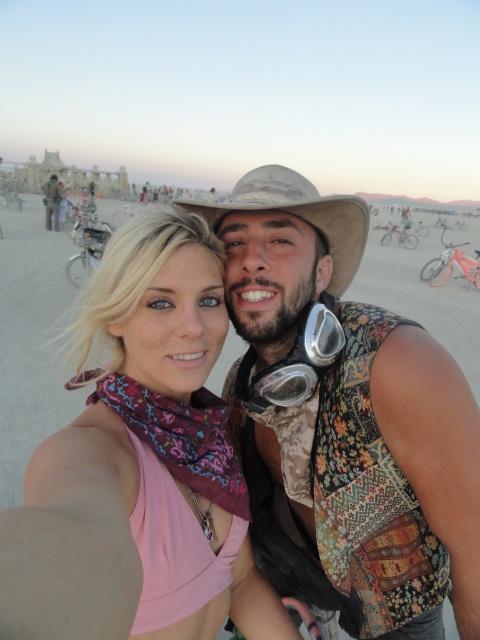
From the picture: Does pink fabric scarf at center have a smaller size compared to silver metallic goggles at center?

No, pink fabric scarf at center is not smaller than silver metallic goggles at center.

Who is more distant from viewer, (111, 552) or (319, 308)?

The point (319, 308) is behind.

This screenshot has height=640, width=480. Find the location of `pink fabric scarf at center`. pink fabric scarf at center is located at coordinates (158, 436).

Does silver metallic goggles at center appear over matte black jacket at upper left?

No, silver metallic goggles at center is not above matte black jacket at upper left.

Which is more to the right, silver metallic goggles at center or matte black jacket at upper left?

Positioned to the right is silver metallic goggles at center.

Is point (261, 381) positioned behind point (57, 220)?

That is False.

Where is `silver metallic goggles at center`? silver metallic goggles at center is located at coordinates (295, 362).

Is floral patchwork vest at center smaller than brown fabric cowboy hat at center?

Actually, floral patchwork vest at center might be larger than brown fabric cowboy hat at center.

Between point (403, 346) and point (279, 188), which one is positioned in front?

Point (403, 346)

Is point (228, 397) positioned before point (361, 212)?

No, it is not.

Find the location of a particular element. floral patchwork vest at center is located at coordinates (347, 424).